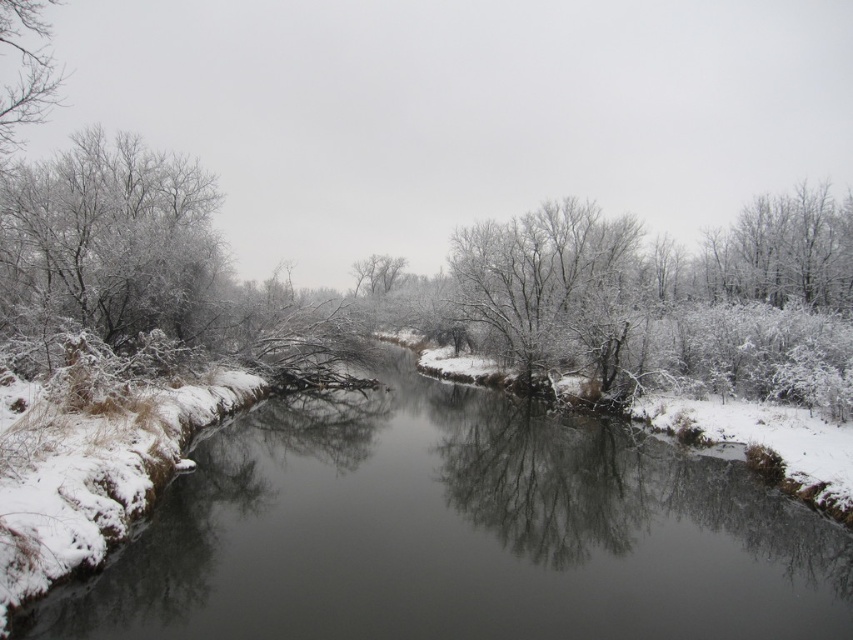
You are an observer standing in the middle of the river. You see the frosted white tree at left and the white frosty tree at upper left. Which tree is closer to you?

The frosted white tree at left is closer to you because the white frosty tree at upper left is positioned behind it.

You are standing at the center of the image and want to locate the white frosted tree at center. Which direction should you look to find it?

The white frosted tree at center is located at point coordinates of 0.445 on the x axis and 0.642 on the y axis, so you should look towards the lower middle area of the image to find the white frosted tree at center.